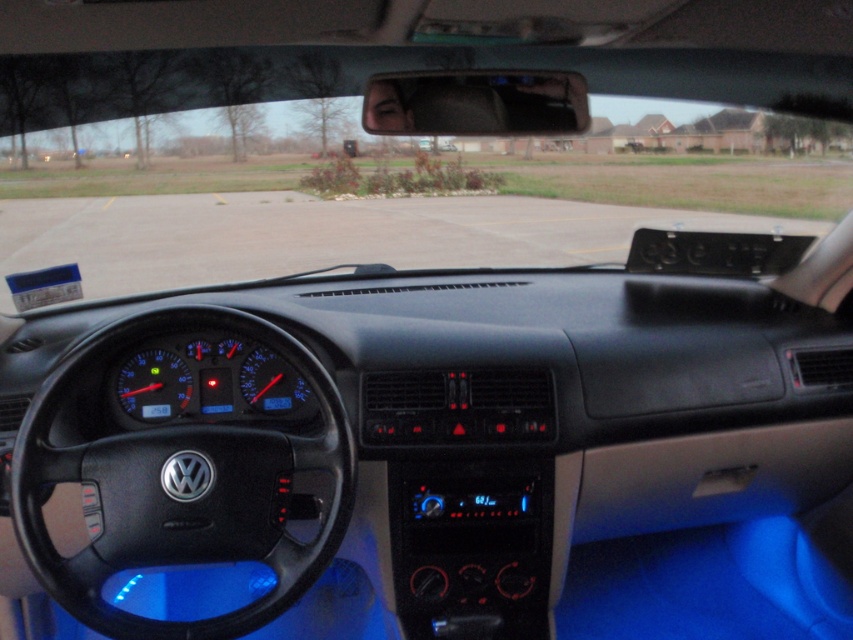
Question: From the image, what is the correct spatial relationship of transparent glass windshield at center in relation to black leather steering wheel at left?

Choices:
 (A) right
 (B) left

Answer: (B)

Question: Is transparent glass windshield at center above black leather steering wheel at left?

Choices:
 (A) yes
 (B) no

Answer: (A)

Question: Which object appears farthest from the camera in this image?

Choices:
 (A) black leather steering wheel at left
 (B) transparent glass windshield at center

Answer: (B)

Question: Is transparent glass windshield at center thinner than black leather steering wheel at left?

Choices:
 (A) yes
 (B) no

Answer: (B)

Question: Which point is farther to the camera?

Choices:
 (A) black leather steering wheel at left
 (B) transparent glass windshield at center

Answer: (B)